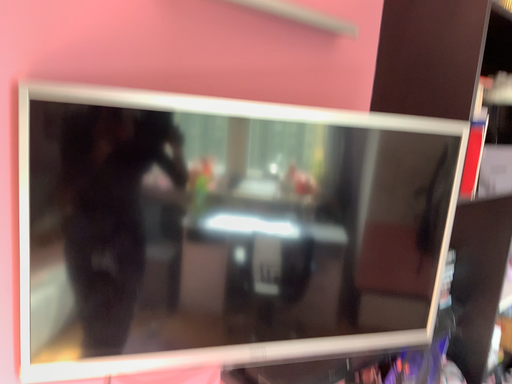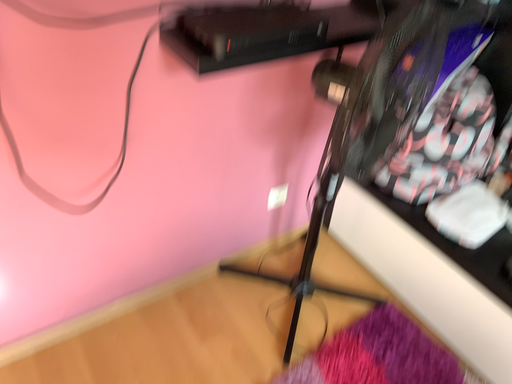
Question: Which way did the camera rotate in the video?

Choices:
 (A) rotated right
 (B) rotated left

Answer: (B)